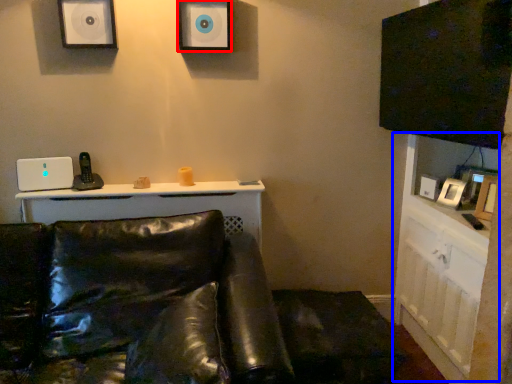
Question: Among these objects, which one is farthest to the camera, speaker (highlighted by a red box) or dresser (highlighted by a blue box)?

Choices:
 (A) speaker
 (B) dresser

Answer: (A)